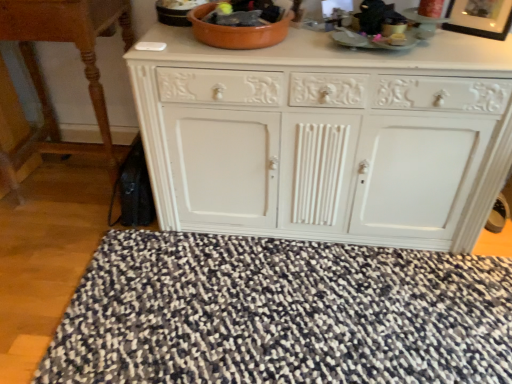
Question: From the image's perspective, is white painted wood cabinet at center above speckled fabric doormat at lower center?

Choices:
 (A) yes
 (B) no

Answer: (A)

Question: Does white painted wood cabinet at center have a lesser width compared to speckled fabric doormat at lower center?

Choices:
 (A) no
 (B) yes

Answer: (B)

Question: Does white painted wood cabinet at center have a greater height compared to speckled fabric doormat at lower center?

Choices:
 (A) yes
 (B) no

Answer: (A)

Question: Is white painted wood cabinet at center positioned behind speckled fabric doormat at lower center?

Choices:
 (A) no
 (B) yes

Answer: (B)

Question: Considering the relative positions of white painted wood cabinet at center and speckled fabric doormat at lower center in the image provided, is white painted wood cabinet at center in front of speckled fabric doormat at lower center?

Choices:
 (A) no
 (B) yes

Answer: (A)

Question: Is white painted wood cabinet at center not close to speckled fabric doormat at lower center?

Choices:
 (A) no
 (B) yes

Answer: (A)

Question: Is speckled fabric doormat at lower center not close to black glossy picture frame at upper right?

Choices:
 (A) no
 (B) yes

Answer: (B)

Question: From a real-world perspective, is speckled fabric doormat at lower center below black glossy picture frame at upper right?

Choices:
 (A) yes
 (B) no

Answer: (A)

Question: Is speckled fabric doormat at lower center looking in the opposite direction of black glossy picture frame at upper right?

Choices:
 (A) yes
 (B) no

Answer: (B)

Question: Does speckled fabric doormat at lower center turn towards black glossy picture frame at upper right?

Choices:
 (A) yes
 (B) no

Answer: (B)

Question: Is speckled fabric doormat at lower center wider than black glossy picture frame at upper right?

Choices:
 (A) yes
 (B) no

Answer: (A)

Question: Does speckled fabric doormat at lower center have a lesser width compared to black glossy picture frame at upper right?

Choices:
 (A) yes
 (B) no

Answer: (B)

Question: Is the depth of speckled fabric doormat at lower center less than that of white painted wood cabinet at center?

Choices:
 (A) yes
 (B) no

Answer: (A)